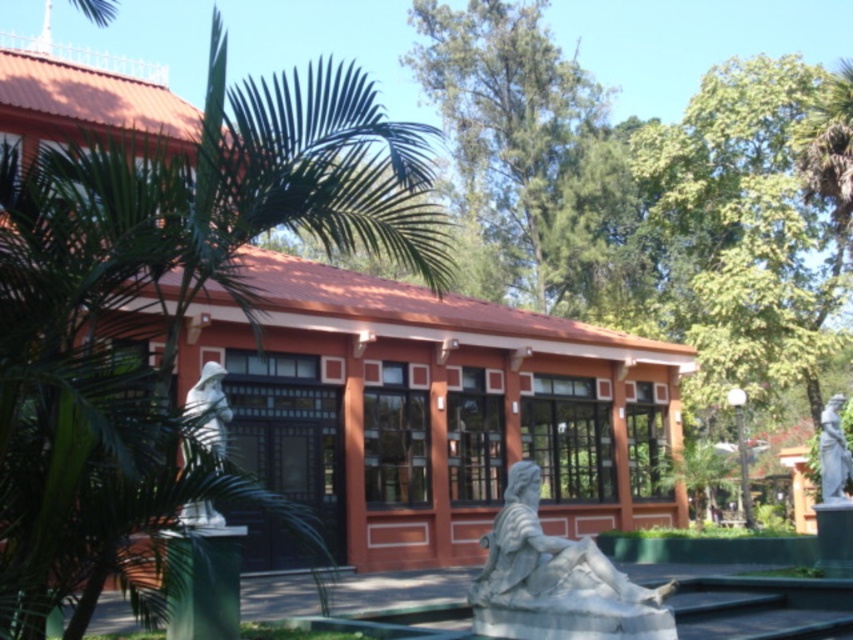
Who is more forward, (199,275) or (183,620)?

Positioned in front is point (199,275).

Between green leafy palm tree at left and green translucent pillar at lower left, which one is positioned lower?

green translucent pillar at lower left is lower down.

Which is behind, point (27, 177) or point (196, 582)?

Positioned behind is point (196, 582).

Where is `green leafy palm tree at left`? The height and width of the screenshot is (640, 853). green leafy palm tree at left is located at coordinates (165, 305).

Is green leafy palm tree at left to the left of green leafy tree at upper center from the viewer's perspective?

Correct, you'll find green leafy palm tree at left to the left of green leafy tree at upper center.

Does green leafy palm tree at left appear over green leafy tree at upper center?

Incorrect, green leafy palm tree at left is not positioned above green leafy tree at upper center.

Between point (54, 308) and point (485, 36), which one is positioned in front?

Positioned in front is point (54, 308).

Locate an element on the screen. The image size is (853, 640). green leafy palm tree at left is located at coordinates pyautogui.click(x=165, y=305).

Can you confirm if green leafy tree at upper center is shorter than white marble statue at left?

Incorrect, green leafy tree at upper center's height does not fall short of white marble statue at left's.

Is point (495, 138) in front of point (224, 433)?

No.

The height and width of the screenshot is (640, 853). In order to click on green leafy tree at upper center in this screenshot , I will do `click(524, 145)`.